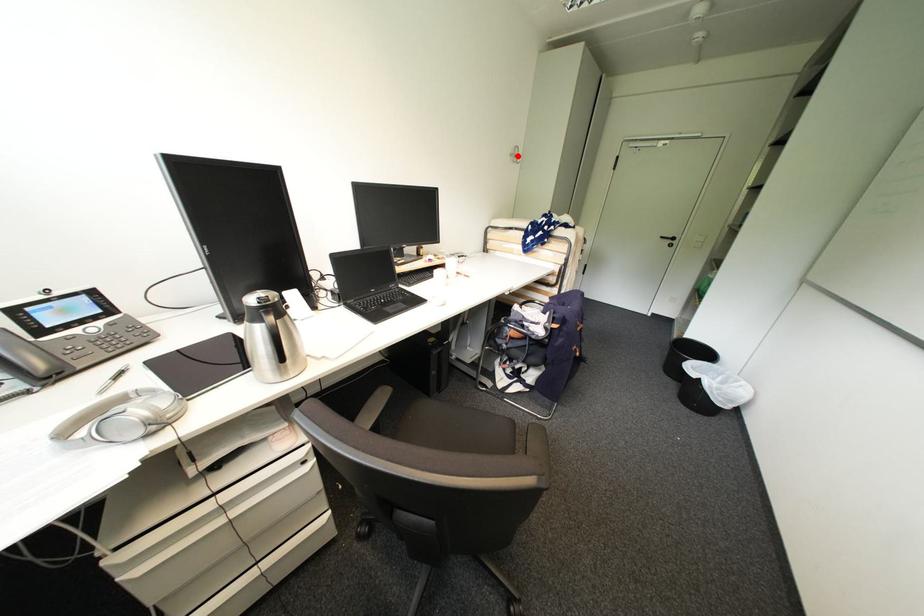
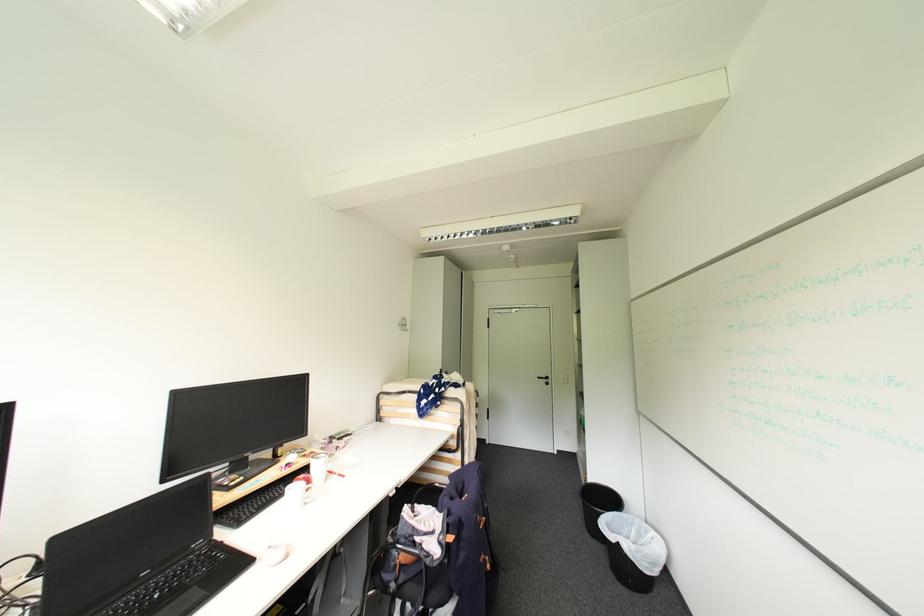
Find the pixel in the second image that matches the highlighted location in the first image.

(406, 325)